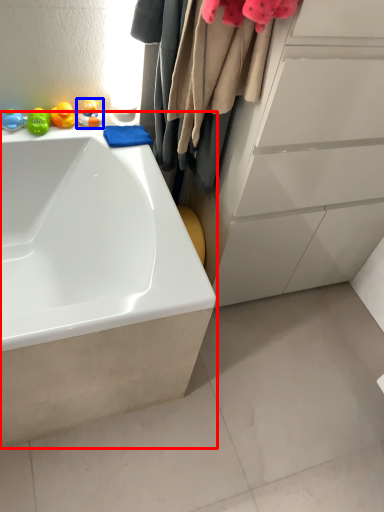
Question: Among these objects, which one is nearest to the camera, bathtub (highlighted by a red box) or toy (highlighted by a blue box)?

Choices:
 (A) bathtub
 (B) toy

Answer: (A)